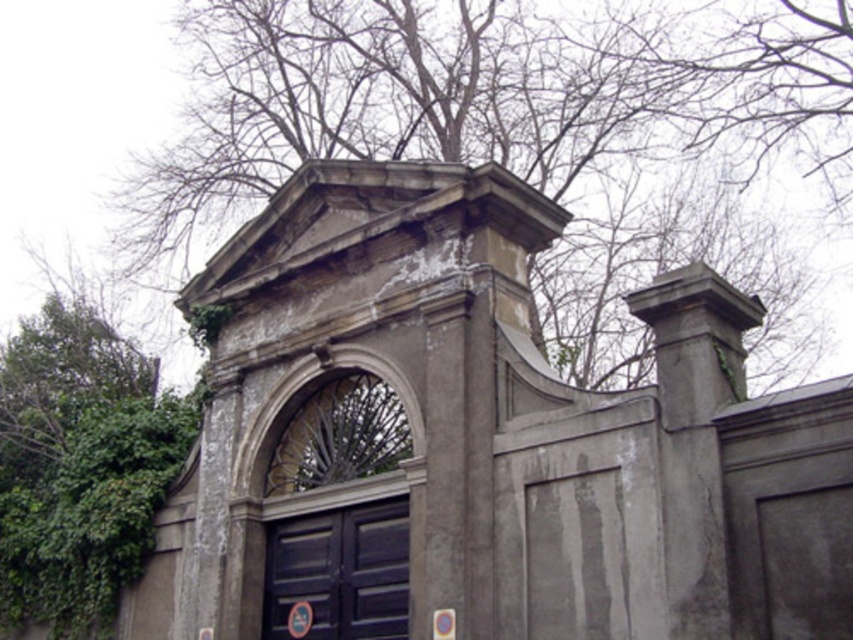
Question: Which point is farther to the camera?

Choices:
 (A) tap(596, 346)
 (B) tap(374, 528)

Answer: (A)

Question: Is green leafy tree at upper center thinner than dark blue wooden door at center?

Choices:
 (A) yes
 (B) no

Answer: (B)

Question: Can you confirm if green leafy tree at upper center is thinner than dark blue wooden door at center?

Choices:
 (A) no
 (B) yes

Answer: (A)

Question: Which point is farther from the camera taking this photo?

Choices:
 (A) pos(595,128)
 (B) pos(401,611)

Answer: (A)

Question: Among these points, which one is nearest to the camera?

Choices:
 (A) (329, 572)
 (B) (473, 120)

Answer: (A)

Question: Is green leafy tree at upper center bigger than dark blue wooden door at center?

Choices:
 (A) yes
 (B) no

Answer: (A)